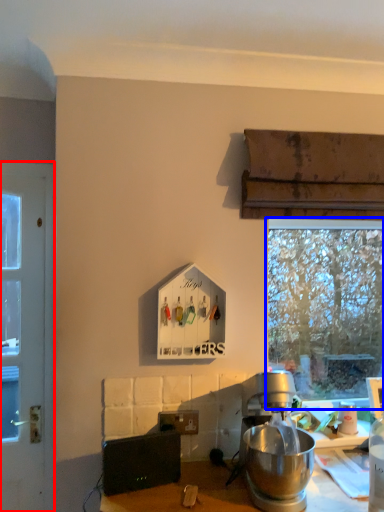
Question: Which object appears farthest to the camera in this image, door (highlighted by a red box) or window (highlighted by a blue box)?

Choices:
 (A) door
 (B) window

Answer: (B)